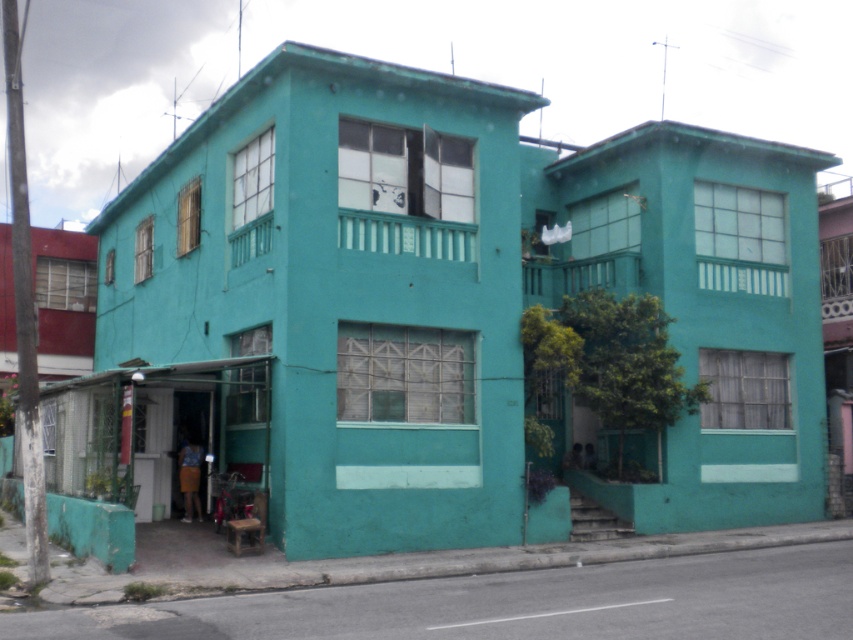
You are a delivery person trying to find the correct entrance to the teal matte building at center and the matte teal building at upper right. Which building is located to the left side of the other?

The teal matte building at center is positioned on the left side of the matte teal building at upper right, so the teal matte building at center is to the left of the matte teal building at upper right.

You are a delivery person trying to decide which building to deliver a package to. You have to choose between the teal matte building at center and the matte teal building at upper right. Which one is taller?

The teal matte building at center is shorter than the matte teal building at upper right, so the matte teal building at upper right is taller.